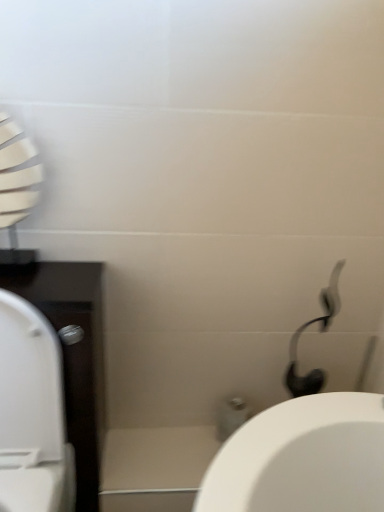
Question: Is white glossy porcelain at center to the right of white matte shower head at upper right from the viewer's perspective?

Choices:
 (A) yes
 (B) no

Answer: (B)

Question: From a real-world perspective, is white glossy porcelain at center positioned over white matte shower head at upper right based on gravity?

Choices:
 (A) no
 (B) yes

Answer: (A)

Question: Is white glossy porcelain at center bigger than white matte shower head at upper right?

Choices:
 (A) yes
 (B) no

Answer: (B)

Question: Is white glossy porcelain at center facing towards white matte shower head at upper right?

Choices:
 (A) yes
 (B) no

Answer: (B)

Question: Is white glossy porcelain at center positioned with its back to white matte shower head at upper right?

Choices:
 (A) no
 (B) yes

Answer: (A)

Question: Considering the relative positions of white glossy porcelain at center and white matte shower head at upper right in the image provided, is white glossy porcelain at center in front of white matte shower head at upper right?

Choices:
 (A) no
 (B) yes

Answer: (A)

Question: Considering the relative sizes of white glossy toilet at left and white matte shower head at upper right in the image provided, is white glossy toilet at left shorter than white matte shower head at upper right?

Choices:
 (A) no
 (B) yes

Answer: (A)

Question: Is white glossy toilet at left not inside white matte shower head at upper right?

Choices:
 (A) no
 (B) yes

Answer: (B)

Question: Is white matte shower head at upper right completely or partially inside white glossy toilet at left?

Choices:
 (A) yes
 (B) no

Answer: (B)

Question: From the image's perspective, is white glossy toilet at left beneath white matte shower head at upper right?

Choices:
 (A) yes
 (B) no

Answer: (A)

Question: From a real-world perspective, is white glossy toilet at left positioned under white matte shower head at upper right based on gravity?

Choices:
 (A) no
 (B) yes

Answer: (B)

Question: Does white glossy toilet at left have a greater width compared to white matte shower head at upper right?

Choices:
 (A) yes
 (B) no

Answer: (A)

Question: Does white glossy porcelain at center have a larger size compared to white glossy toilet at left?

Choices:
 (A) no
 (B) yes

Answer: (A)